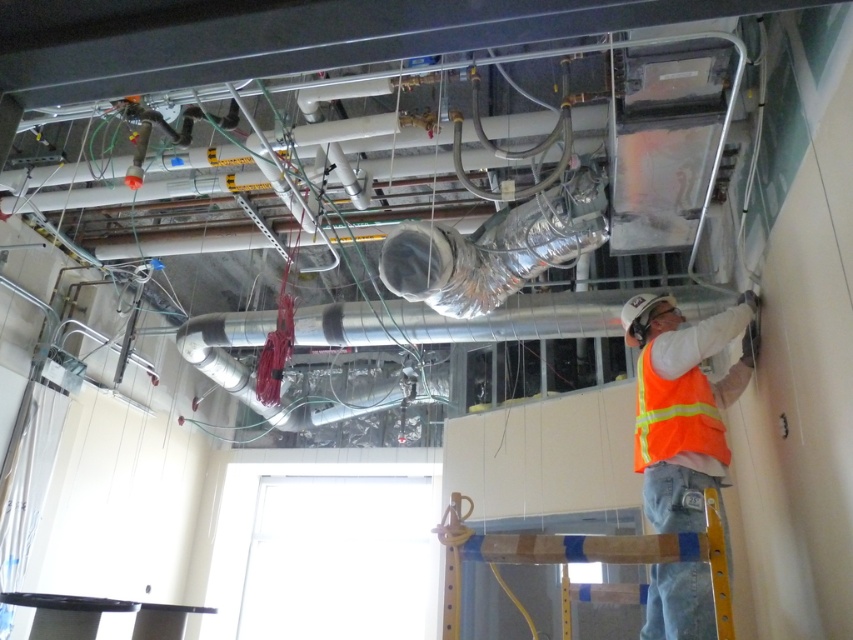
You are a technician standing in the middle of the room and need to reach both the point at coordinates (x=512, y=244) and the point at coordinates (x=492, y=570). Which point should you approach first to reach the closer one first?

You should approach point (x=512, y=244) first because it is closer to you than point (x=492, y=570). The description states that point (x=512, y=244) is further to the viewer than point (x=492, y=570), which means it is physically nearer in the scene.

You are a safety inspector in the construction site. You notice the orange reflective vest at center and the wooden beam at center. Which object is placed above the other?

The orange reflective vest at center is positioned over the wooden beam at center, meaning it is placed above the wooden beam.

You are an HVAC technician inspecting the installation. You need to locate the silver metallic duct at upper center. According to the coordinates provided, where exactly is it positioned?

The silver metallic duct at upper center is located at point (495, 248).